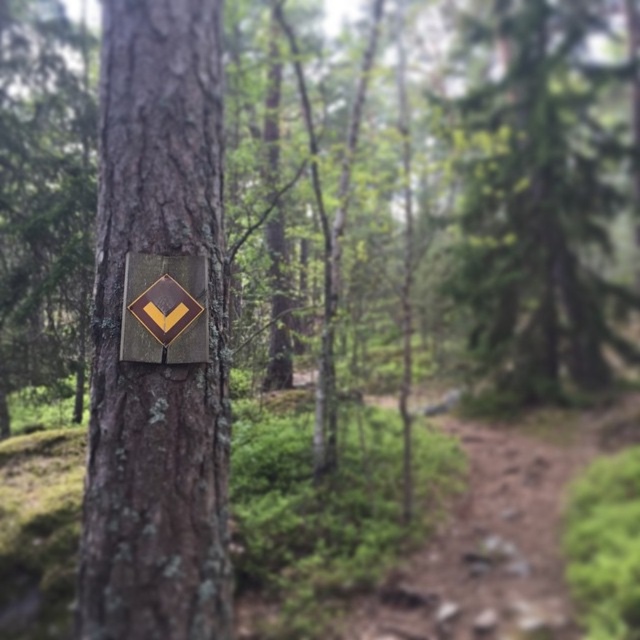
Does green textured tree at center have a lesser height compared to metallic gold diamond at center?

In fact, green textured tree at center may be taller than metallic gold diamond at center.

Does point (625, 308) come in front of point (154, 332)?

No, it is behind (154, 332).

Between point (451, 115) and point (148, 262), which one is positioned in front?

Point (148, 262) is in front.

Where is `green textured tree at center`? The height and width of the screenshot is (640, 640). green textured tree at center is located at coordinates (541, 196).

Is smooth bark sign at center below metallic gold diamond at center?

No.

Between smooth bark sign at center and metallic gold diamond at center, which one appears on the right side from the viewer's perspective?

metallic gold diamond at center

Who is more forward, (108, 164) or (170, 348)?

Point (170, 348)

In order to click on smooth bark sign at center in this screenshot , I will do `click(157, 364)`.

Which is more to the left, smooth bark sign at center or green textured tree at center?

From the viewer's perspective, smooth bark sign at center appears more on the left side.

Who is more distant from viewer, [154,557] or [593,387]?

The point [593,387] is more distant.

Identify the location of smooth bark sign at center. (157, 364).